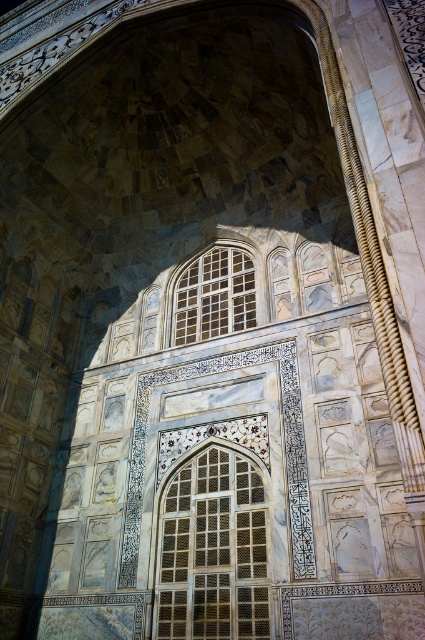
You are an architect designing a new building and want to incorporate two types of windows, a matte glass window at center and a translucent glass window at center, into a large arched opening. Given that the two windows are positioned at the same central location, how far apart are they from each other?

→ The matte glass window at center is 18.25 meters away from the translucent glass window at center.

You are an architect designing a new building inspired by this structure. You want to install two types of glass windows at the center of an arch similar to the one shown. The matte glass window at center and the translucent glass window at center must be placed such that their sizes match the original design. Which window should be larger?

The matte glass window at center should be larger than the translucent glass window at center because the original design specifies that the matte glass window at center is bigger than the translucent glass window at center.